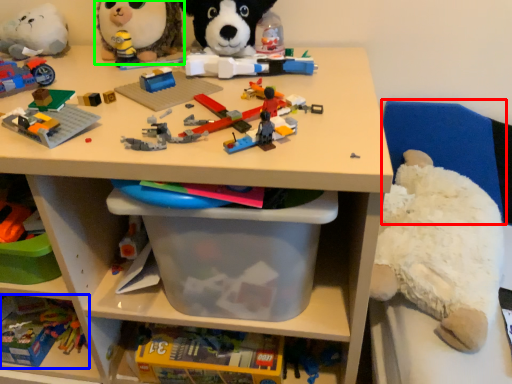
Question: Based on their relative distances, which object is farther from chair (highlighted by a red box)? Choose from toy (highlighted by a blue box) and toy (highlighted by a green box).

Choices:
 (A) toy
 (B) toy

Answer: (A)